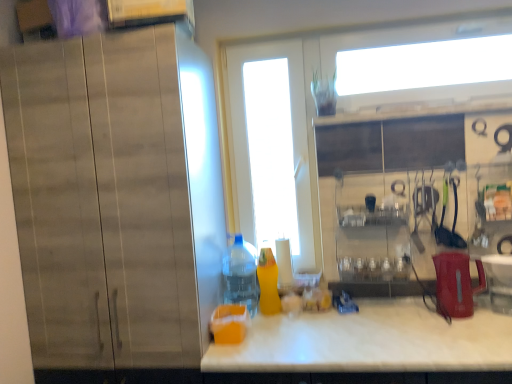
Question: Looking at their shapes, would you say matte wood cabinet at left is wider or thinner than white marble countertop at center?

Choices:
 (A) thin
 (B) wide

Answer: (B)

Question: Do you think matte wood cabinet at left is within white marble countertop at center, or outside of it?

Choices:
 (A) outside
 (B) inside

Answer: (A)

Question: Which of these objects is positioned closest to the yellow glass bottle at center, which is the 2th bottle in left-to-right order?

Choices:
 (A) white glossy sink at right
 (B) translucent orange juice at lower center
 (C) white glossy screen door at center
 (D) translucent plastic bottle at center, arranged as the 2th bottle when viewed from the right
 (E) white marble countertop at center

Answer: (D)

Question: Which is nearer to the red plastic kettle at right?

Choices:
 (A) white glossy sink at right
 (B) yellow glass bottle at center, which is the 2th bottle in left-to-right order
 (C) matte wood cabinet at left
 (D) translucent orange juice at lower center
 (E) translucent plastic bottle at center, arranged as the 2th bottle when viewed from the right

Answer: (A)